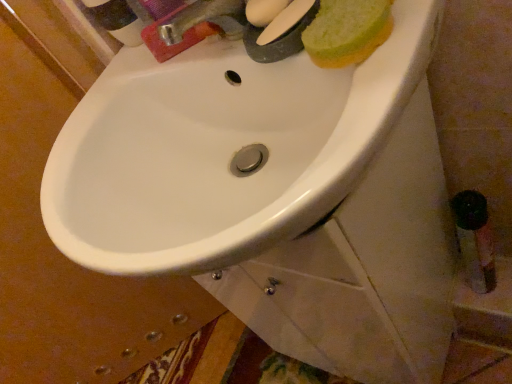
Question: Should I look upward or downward to see green sponge at upper right?

Choices:
 (A) down
 (B) up

Answer: (B)

Question: From the image's perspective, does green sponge at upper right appear higher than metallic silver faucet at upper center?

Choices:
 (A) yes
 (B) no

Answer: (B)

Question: From a real-world perspective, is green sponge at upper right beneath metallic silver faucet at upper center?

Choices:
 (A) yes
 (B) no

Answer: (A)

Question: Does green sponge at upper right come behind metallic silver faucet at upper center?

Choices:
 (A) no
 (B) yes

Answer: (A)

Question: Can you confirm if green sponge at upper right is positioned to the left of metallic silver faucet at upper center?

Choices:
 (A) no
 (B) yes

Answer: (A)

Question: Is the position of green sponge at upper right less distant than that of metallic silver faucet at upper center?

Choices:
 (A) yes
 (B) no

Answer: (A)

Question: Is green sponge at upper right far from metallic silver faucet at upper center?

Choices:
 (A) no
 (B) yes

Answer: (A)

Question: Is green sponge at upper right shorter than white glossy sink at center?

Choices:
 (A) yes
 (B) no

Answer: (A)

Question: From the image's perspective, is green sponge at upper right over white glossy sink at center?

Choices:
 (A) yes
 (B) no

Answer: (A)

Question: Is green sponge at upper right turned away from white glossy sink at center?

Choices:
 (A) yes
 (B) no

Answer: (B)

Question: Does green sponge at upper right appear on the left side of white glossy sink at center?

Choices:
 (A) yes
 (B) no

Answer: (B)

Question: Is green sponge at upper right directly adjacent to white glossy sink at center?

Choices:
 (A) yes
 (B) no

Answer: (B)

Question: Is green sponge at upper right bigger than white glossy sink at center?

Choices:
 (A) no
 (B) yes

Answer: (A)

Question: Is metallic silver faucet at upper center oriented towards white glossy sink at center?

Choices:
 (A) no
 (B) yes

Answer: (A)